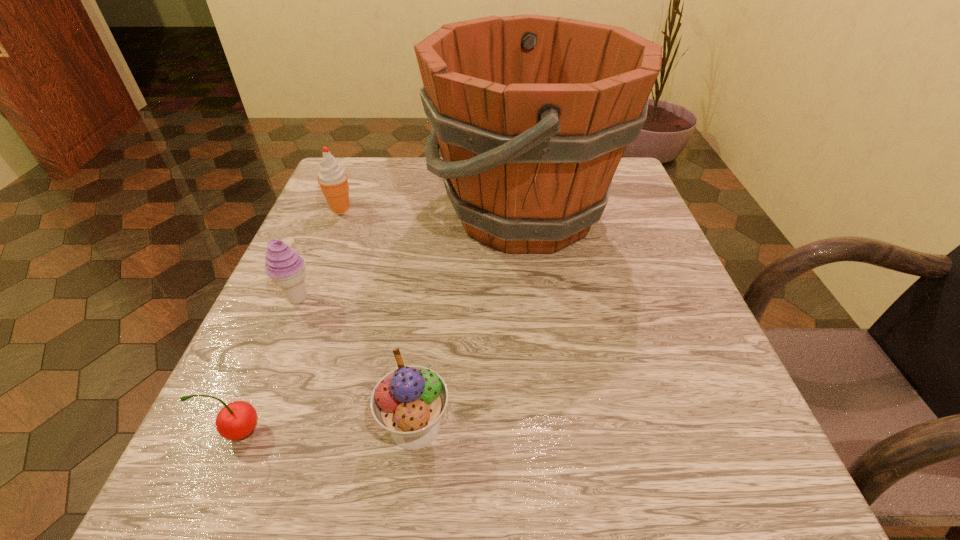
This screenshot has width=960, height=540. What are the coordinates of `object positioned at the far right corner` in the screenshot? It's located at (532, 114).

Locate an element on the screen. vacant space at the far edge of the desktop is located at coordinates (426, 178).

Locate an element on the screen. The height and width of the screenshot is (540, 960). free space at the near edge of the desktop is located at coordinates (352, 496).

The image size is (960, 540). In the image, there is a desktop. Find the location of `vacant space at the left edge`. vacant space at the left edge is located at coordinates (351, 338).

The image size is (960, 540). Find the location of `vacant space at the right edge`. vacant space at the right edge is located at coordinates (657, 230).

In the image, there is a desktop. Identify the location of blank space at the far left corner. This screenshot has height=540, width=960. (364, 158).

The width and height of the screenshot is (960, 540). I want to click on vacant space at the near left corner of the desktop, so click(217, 496).

This screenshot has width=960, height=540. Identify the location of vacant space at the far right corner of the desktop. (619, 180).

The image size is (960, 540). Find the location of `vacant area at the near right corner`. vacant area at the near right corner is located at coordinates (676, 454).

Where is `empty space that is in between the nearest icecream and the bucket`? This screenshot has width=960, height=540. empty space that is in between the nearest icecream and the bucket is located at coordinates (469, 320).